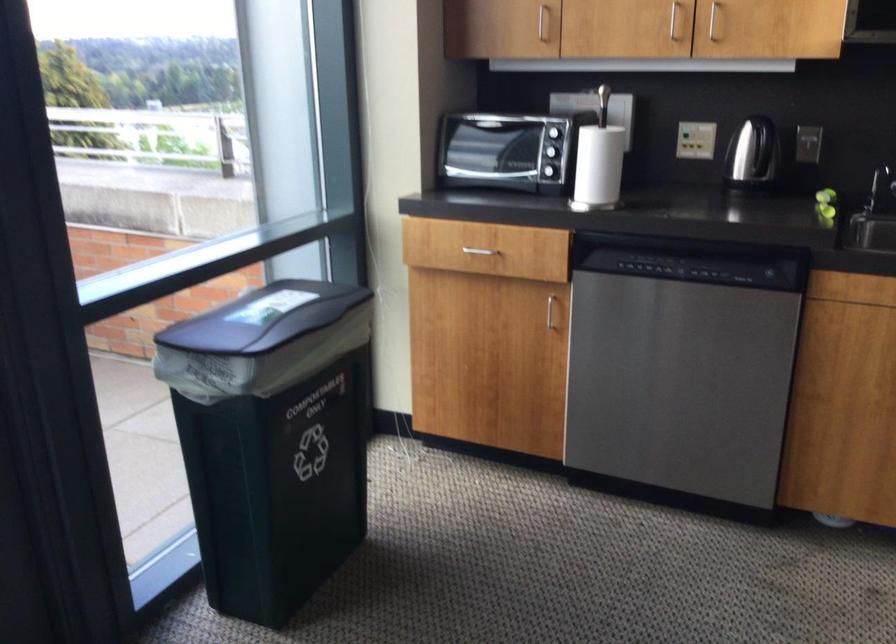
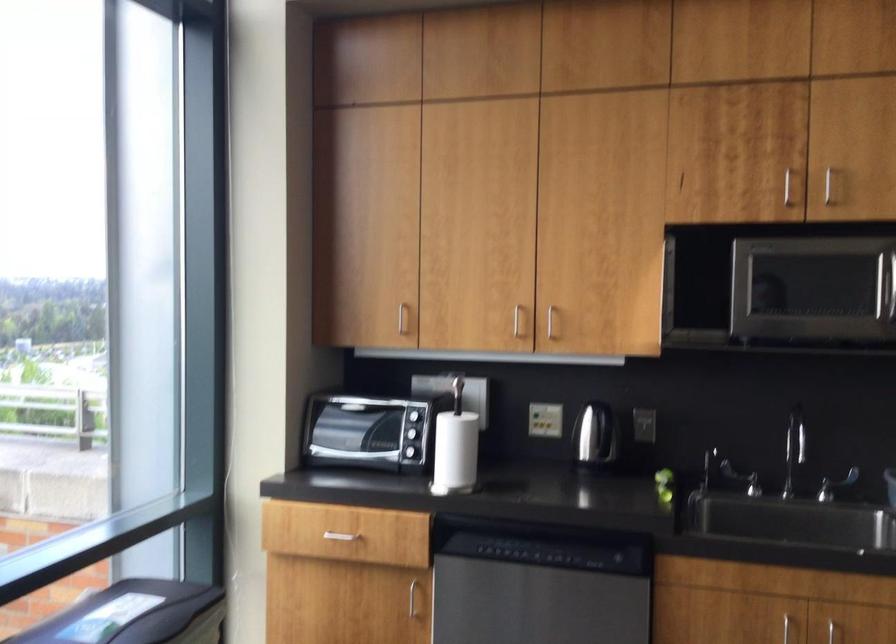
Question: What movement of the cameraman would produce the second image?

Choices:
 (A) Left
 (B) Right
 (C) Forward
 (D) Backward

Answer: (D)